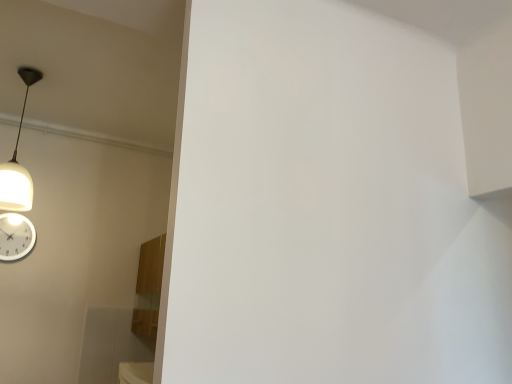
Question: From a real-world perspective, is white matte lampshade at upper left positioned over white glossy wall clock at lower left based on gravity?

Choices:
 (A) yes
 (B) no

Answer: (A)

Question: Is the position of white matte lampshade at upper left less distant than that of white glossy wall clock at lower left?

Choices:
 (A) no
 (B) yes

Answer: (B)

Question: Can you confirm if white matte lampshade at upper left is positioned to the right of white glossy wall clock at lower left?

Choices:
 (A) yes
 (B) no

Answer: (A)

Question: Does white matte lampshade at upper left have a smaller size compared to white glossy wall clock at lower left?

Choices:
 (A) yes
 (B) no

Answer: (B)

Question: Considering the relative sizes of white matte lampshade at upper left and white glossy wall clock at lower left in the image provided, is white matte lampshade at upper left bigger than white glossy wall clock at lower left?

Choices:
 (A) no
 (B) yes

Answer: (B)

Question: Considering the relative sizes of white matte lampshade at upper left and white glossy wall clock at lower left in the image provided, is white matte lampshade at upper left wider than white glossy wall clock at lower left?

Choices:
 (A) yes
 (B) no

Answer: (A)

Question: Does white glossy wall clock at lower left have a lesser height compared to white matte lampshade at upper left?

Choices:
 (A) no
 (B) yes

Answer: (B)

Question: Considering the relative sizes of white glossy wall clock at lower left and white matte lampshade at upper left in the image provided, is white glossy wall clock at lower left thinner than white matte lampshade at upper left?

Choices:
 (A) no
 (B) yes

Answer: (B)

Question: From a real-world perspective, is white glossy wall clock at lower left physically below white matte lampshade at upper left?

Choices:
 (A) yes
 (B) no

Answer: (A)

Question: Is white glossy wall clock at lower left outside of white matte lampshade at upper left?

Choices:
 (A) no
 (B) yes

Answer: (B)

Question: Is white glossy wall clock at lower left at the left side of white matte lampshade at upper left?

Choices:
 (A) yes
 (B) no

Answer: (A)

Question: Are white glossy wall clock at lower left and white matte lampshade at upper left far apart?

Choices:
 (A) no
 (B) yes

Answer: (A)

Question: Is point (5, 236) positioned closer to the camera than point (34, 71)?

Choices:
 (A) farther
 (B) closer

Answer: (A)